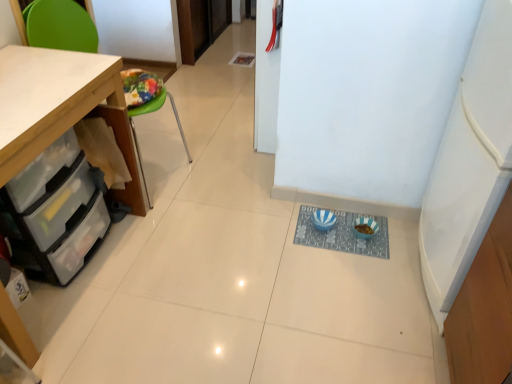
Question: From the image's perspective, does wooden cabinet at left appear lower than clear plastic drawers at lower left?

Choices:
 (A) yes
 (B) no

Answer: (B)

Question: Is wooden cabinet at left touching clear plastic drawers at lower left?

Choices:
 (A) no
 (B) yes

Answer: (A)

Question: Is wooden cabinet at left at the right side of clear plastic drawers at lower left?

Choices:
 (A) yes
 (B) no

Answer: (A)

Question: Is clear plastic drawers at lower left a part of wooden cabinet at left?

Choices:
 (A) yes
 (B) no

Answer: (A)

Question: From the image's perspective, is wooden cabinet at left located above clear plastic drawers at lower left?

Choices:
 (A) no
 (B) yes

Answer: (B)

Question: Can you confirm if wooden cabinet at left is shorter than clear plastic drawers at lower left?

Choices:
 (A) no
 (B) yes

Answer: (A)

Question: Considering the relative positions of wooden cabinet at left and blue striped bowls at center in the image provided, is wooden cabinet at left to the left of blue striped bowls at center from the viewer's perspective?

Choices:
 (A) no
 (B) yes

Answer: (B)

Question: Considering the relative sizes of wooden cabinet at left and blue striped bowls at center in the image provided, is wooden cabinet at left bigger than blue striped bowls at center?

Choices:
 (A) yes
 (B) no

Answer: (A)

Question: From the image's perspective, would you say wooden cabinet at left is shown under blue striped bowls at center?

Choices:
 (A) yes
 (B) no

Answer: (B)

Question: From a real-world perspective, is wooden cabinet at left beneath blue striped bowls at center?

Choices:
 (A) yes
 (B) no

Answer: (B)

Question: From the image's perspective, is wooden cabinet at left over blue striped bowls at center?

Choices:
 (A) no
 (B) yes

Answer: (B)

Question: Is wooden cabinet at left shorter than blue striped bowls at center?

Choices:
 (A) no
 (B) yes

Answer: (A)

Question: Is clear plastic drawers at lower left aimed at wooden cabinet at left?

Choices:
 (A) no
 (B) yes

Answer: (B)